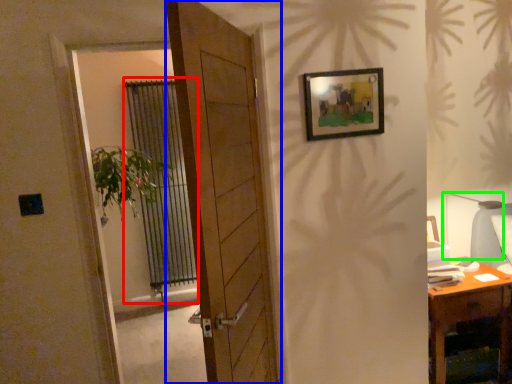
Question: Considering the real-world distances, which object is closest to curtain (highlighted by a red box)? door (highlighted by a blue box) or table lamp (highlighted by a green box).

Choices:
 (A) door
 (B) table lamp

Answer: (A)